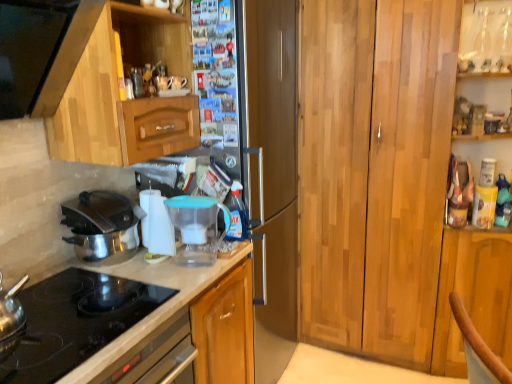
I want to click on free space underneath transparent plastic water filter pitcher at center, which is counted as the 2th appliance, starting from the left (from a real-world perspective), so click(198, 265).